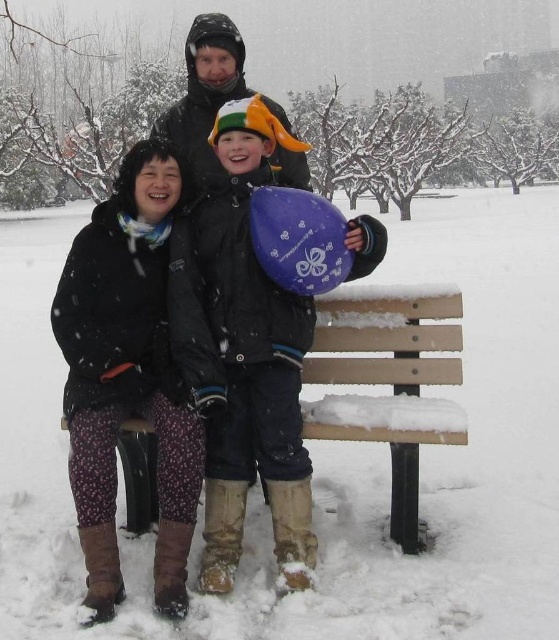
Is purple matte balloon at center positioned before wooden bench at center?

No, it is behind wooden bench at center.

Between purple matte balloon at center and wooden bench at center, which one is positioned lower?

wooden bench at center is lower down.

Which is in front, point (231, 358) or point (456, 326)?

Point (231, 358) is more forward.

The width and height of the screenshot is (559, 640). In order to click on purple matte balloon at center in this screenshot , I will do `click(243, 353)`.

Based on the photo, who is more forward, (228, 577) or (193, 72)?

Positioned in front is point (228, 577).

What do you see at coordinates (243, 353) in the screenshot? This screenshot has height=640, width=559. I see `purple matte balloon at center` at bounding box center [243, 353].

Where is `purple matte balloon at center`? The image size is (559, 640). purple matte balloon at center is located at coordinates (243, 353).

Which is more to the right, wooden bench at center or matte black jacket at upper center?

wooden bench at center

Is wooden bench at center wider than matte black jacket at upper center?

Incorrect, wooden bench at center's width does not surpass matte black jacket at upper center's.

Between point (408, 342) and point (226, 77), which one is positioned in front?

Positioned in front is point (408, 342).

The width and height of the screenshot is (559, 640). In order to click on wooden bench at center in this screenshot , I will do `click(389, 381)`.